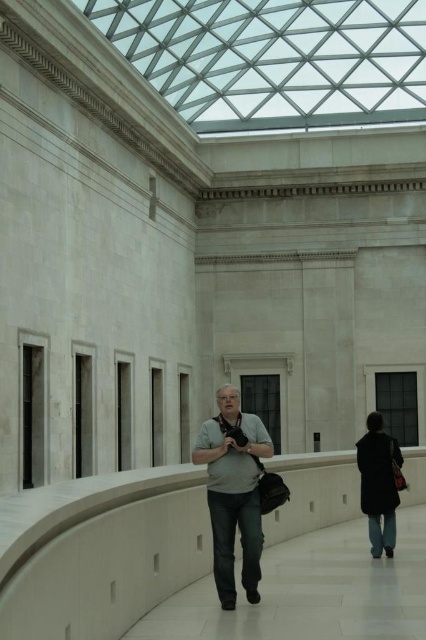
Question: Is gray matte shirt at center bigger than dark blue coat at lower right?

Choices:
 (A) yes
 (B) no

Answer: (B)

Question: Is gray matte shirt at center thinner than dark blue coat at lower right?

Choices:
 (A) yes
 (B) no

Answer: (B)

Question: Which point appears farthest from the camera in this image?

Choices:
 (A) (247, 420)
 (B) (363, 444)

Answer: (B)

Question: Which object appears farthest from the camera in this image?

Choices:
 (A) gray matte shirt at center
 (B) dark blue coat at lower right

Answer: (B)

Question: Which point is farther to the camera?

Choices:
 (A) (368, 522)
 (B) (253, 552)

Answer: (A)

Question: Considering the relative positions of gray matte shirt at center and dark blue coat at lower right in the image provided, where is gray matte shirt at center located with respect to dark blue coat at lower right?

Choices:
 (A) right
 (B) left

Answer: (B)